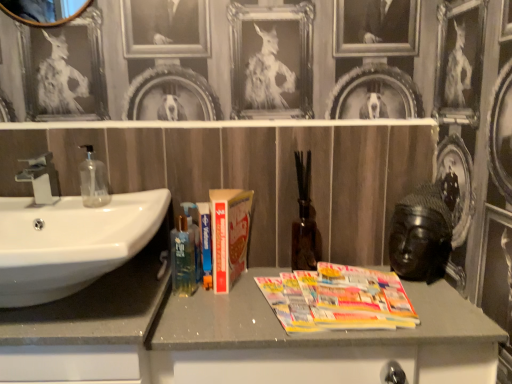
Image resolution: width=512 pixels, height=384 pixels. I want to click on blank area to the left of multicolored glossy magazines at center, so click(x=230, y=308).